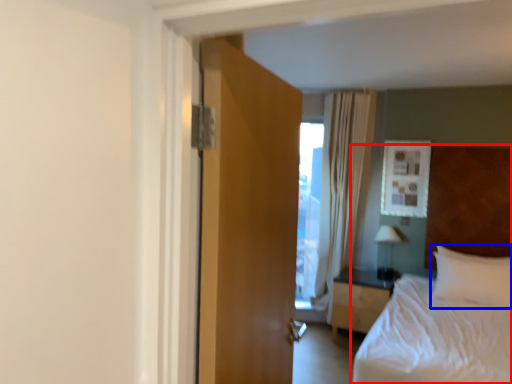
Question: Among these objects, which one is nearest to the camera, bed (highlighted by a red box) or pillow (highlighted by a blue box)?

Choices:
 (A) bed
 (B) pillow

Answer: (A)